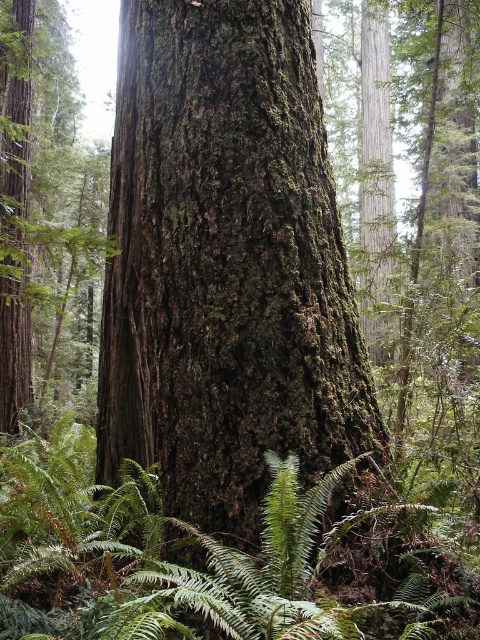
You are a botanist examining the tree trunk in the image. You need to locate the green mossy bark at center. Where exactly should you look on the trunk?

The green mossy bark at center is located at point [226,264] on the trunk.

You are a botanist measuring the width of plants in the forest. You observe the green mossy bark at center and the green leafy fern at center. Which one has a smaller width?

The green mossy bark at center has a smaller width than the green leafy fern at center.

You are a botanist studying plant growth in a forest. You observe the green mossy bark at center and the green leafy fern at center. Which of these two plants is taller?

The green mossy bark at center is taller than the green leafy fern at center.